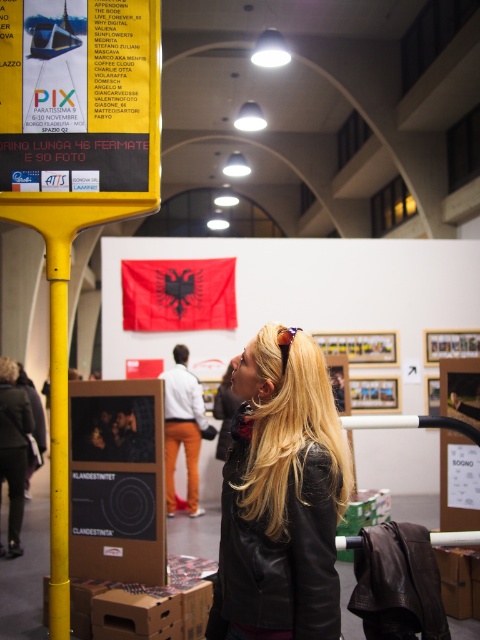
Is black leather jacket at lower left wider than blonde hair at upper left?

Correct, the width of black leather jacket at lower left exceeds that of blonde hair at upper left.

Between point (11, 396) and point (6, 356), which one is positioned in front?

Point (11, 396)

Image resolution: width=480 pixels, height=640 pixels. I want to click on black leather jacket at lower left, so click(x=13, y=448).

Looking at this image, does black leather jacket at center have a larger size compared to blonde hair at upper left?

Correct, black leather jacket at center is larger in size than blonde hair at upper left.

Which is more to the right, black leather jacket at center or blonde hair at upper left?

From the viewer's perspective, black leather jacket at center appears more on the right side.

At what (x,y) coordinates should I click in order to perform the action: click on black leather jacket at center. Please return your answer as a coordinate pair (x, y). Looking at the image, I should click on pyautogui.click(x=280, y=497).

Who is higher up, yellow matte pole at left or blonde hair at upper left?

yellow matte pole at left

Can you confirm if yellow matte pole at left is bigger than blonde hair at upper left?

Yes.

Is point (61, 592) more distant than point (0, 372)?

No, it is not.

Locate an element on the screen. yellow matte pole at left is located at coordinates (59, 444).